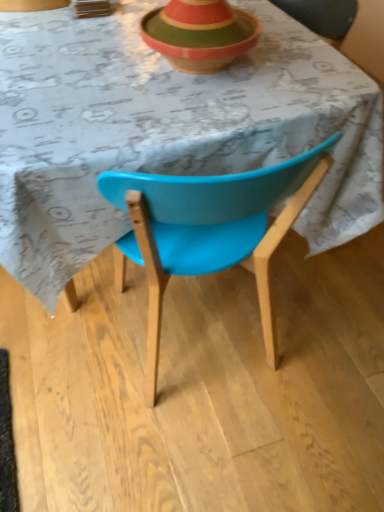
Question: In terms of size, does blue plastic chair at center appear bigger or smaller than wooden striped bowl at upper center?

Choices:
 (A) big
 (B) small

Answer: (A)

Question: From the image's perspective, is blue plastic chair at center above or below wooden striped bowl at upper center?

Choices:
 (A) below
 (B) above

Answer: (A)

Question: In the image, is blue plastic chair at center positioned in front of or behind wooden striped bowl at upper center?

Choices:
 (A) front
 (B) behind

Answer: (A)

Question: Is wooden striped bowl at upper center inside or outside of blue plastic chair at center?

Choices:
 (A) outside
 (B) inside

Answer: (A)

Question: Considering their positions, is wooden striped bowl at upper center located in front of or behind blue plastic chair at center?

Choices:
 (A) front
 (B) behind

Answer: (B)

Question: Considering the relative positions of wooden striped bowl at upper center and blue plastic chair at center in the image provided, is wooden striped bowl at upper center to the left or to the right of blue plastic chair at center?

Choices:
 (A) left
 (B) right

Answer: (B)

Question: In terms of width, does wooden striped bowl at upper center look wider or thinner when compared to blue plastic chair at center?

Choices:
 (A) thin
 (B) wide

Answer: (A)